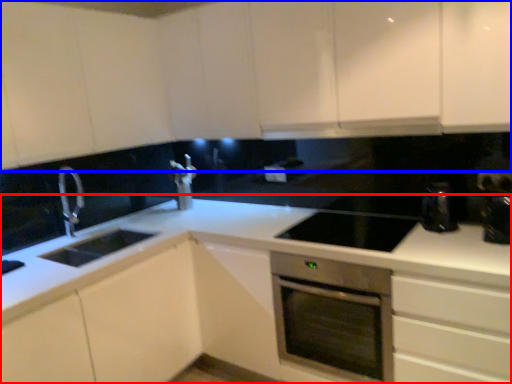
Question: Which object is closer to the camera taking this photo, countertop (highlighted by a red box) or cabinetry (highlighted by a blue box)?

Choices:
 (A) countertop
 (B) cabinetry

Answer: (B)